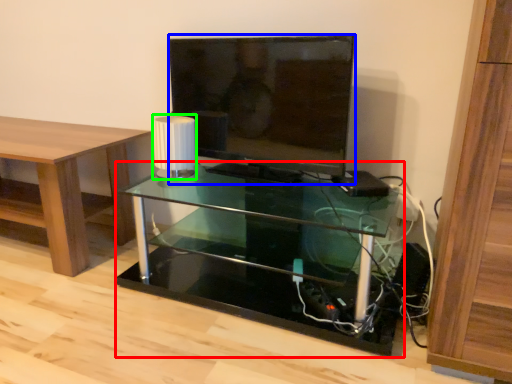
Question: Considering the real-world distances, which object is farthest from shelf (highlighted by a red box)? television (highlighted by a blue box) or lamp (highlighted by a green box)?

Choices:
 (A) television
 (B) lamp

Answer: (B)